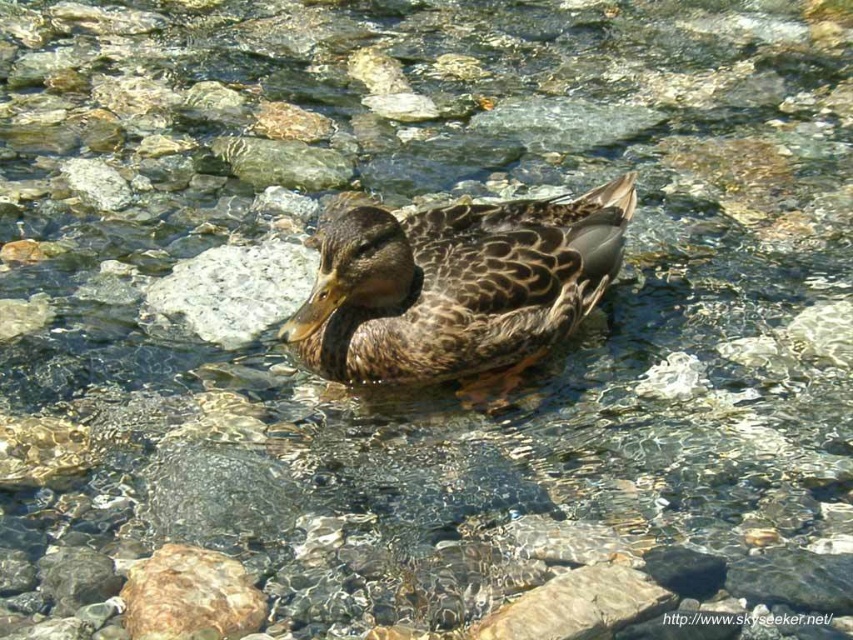
Question: Which point is farther from the camera taking this photo?

Choices:
 (A) (161, 561)
 (B) (247, 324)
 (C) (357, 308)

Answer: (B)

Question: Is gray smooth rock at center to the right of brown rough rock at lower left from the viewer's perspective?

Choices:
 (A) no
 (B) yes

Answer: (A)

Question: Which point is closer to the camera taking this photo?

Choices:
 (A) (300, 252)
 (B) (601, 253)
 (C) (244, 577)

Answer: (C)

Question: Which of the following is the closest to the observer?

Choices:
 (A) (529, 362)
 (B) (303, 257)
 (C) (242, 604)

Answer: (C)

Question: Can you confirm if brown speckled feathers at center is positioned above gray smooth rock at center?

Choices:
 (A) no
 (B) yes

Answer: (A)

Question: From the image, what is the correct spatial relationship of brown speckled feathers at center in relation to gray smooth rock at center?

Choices:
 (A) above
 (B) below

Answer: (B)